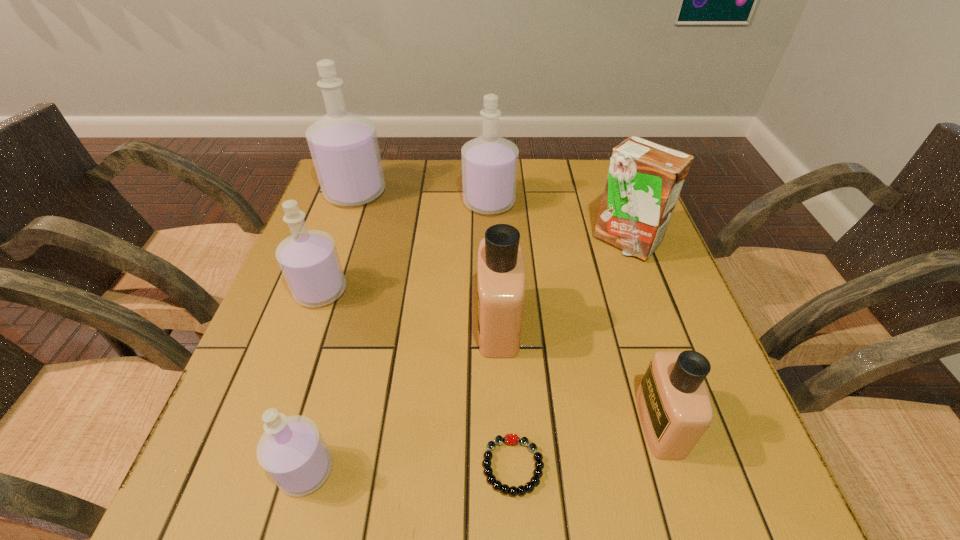
Where is `blank space located on the front label of the right beige perfume`? blank space located on the front label of the right beige perfume is located at coordinates (508, 423).

Where is `free space located on the front label of the right beige perfume`? This screenshot has width=960, height=540. free space located on the front label of the right beige perfume is located at coordinates (548, 423).

Where is `vacant space located 0.270m on the front label of the right beige perfume`? The height and width of the screenshot is (540, 960). vacant space located 0.270m on the front label of the right beige perfume is located at coordinates (485, 423).

Find the location of a particular element. The height and width of the screenshot is (540, 960). free space located 0.060m on the right of the nearest purple perfume is located at coordinates (371, 470).

Identify the location of free location located on the back of the shortest object. (509, 384).

You are a GUI agent. You are given a task and a screenshot of the screen. Output one action in this format:
    pyautogui.click(x=<x>, y=<y>)
    Task: Click on the perfume that is positioned at the near edge
    The width and height of the screenshot is (960, 540).
    Given the screenshot: What is the action you would take?
    pyautogui.click(x=292, y=451)

Image resolution: width=960 pixels, height=540 pixels. What are the coordinates of `bracelet located in the near edge section of the desktop` in the screenshot? It's located at (512, 439).

You are a GUI agent. You are given a task and a screenshot of the screen. Output one action in this format:
    pyautogui.click(x=<x>, y=<y>)
    Task: Click on the carton present at the right edge
    This screenshot has height=540, width=960.
    Given the screenshot: What is the action you would take?
    pyautogui.click(x=644, y=180)

Where is `perfume located at the right edge`? This screenshot has width=960, height=540. perfume located at the right edge is located at coordinates (675, 409).

Find the location of `object that is at the far left corner`. object that is at the far left corner is located at coordinates (344, 147).